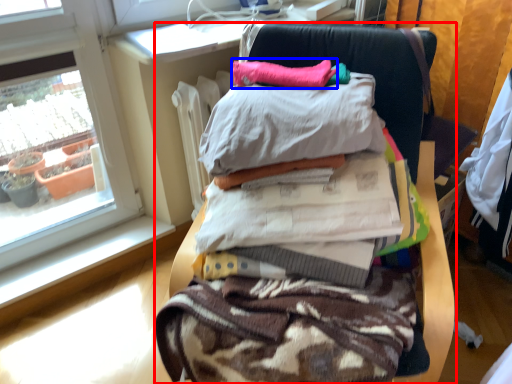
Question: Which of the following is the farthest to the observer, furniture (highlighted by a red box) or pillow (highlighted by a blue box)?

Choices:
 (A) furniture
 (B) pillow

Answer: (B)